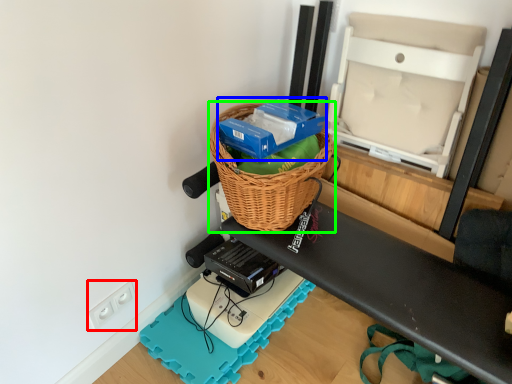
Question: Which object is the farthest from electric outlet (highlighted by a red box)? Choose among these: box (highlighted by a blue box) or picnic basket (highlighted by a green box).

Choices:
 (A) box
 (B) picnic basket

Answer: (A)